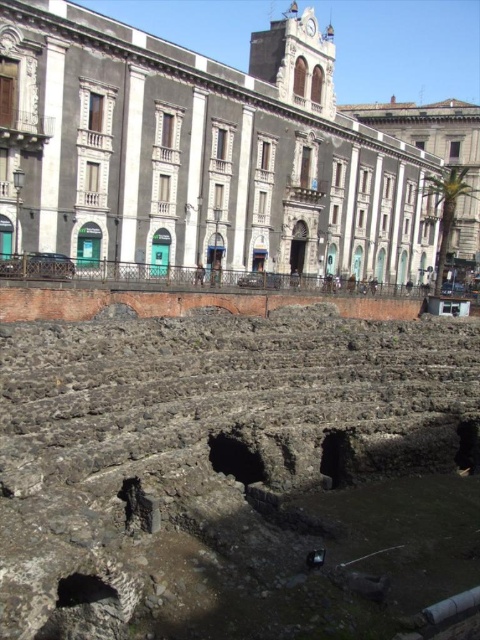
Can you confirm if dusty stone ruins at lower center is positioned to the right of dark gray stone building at center?

In fact, dusty stone ruins at lower center is to the left of dark gray stone building at center.

Between point (425, 342) and point (369, 205), which one is positioned behind?

The point (369, 205) is behind.

Between point (391, 627) and point (29, 58), which one is positioned in front?

Positioned in front is point (391, 627).

At what (x,y) coordinates should I click in order to perform the action: click on dusty stone ruins at lower center. Please return your answer as a coordinate pair (x, y). This screenshot has height=640, width=480. Looking at the image, I should click on (232, 476).

Is point (62, 593) positioned after point (458, 452)?

That is False.

Can you confirm if dark gray stone hole at lower left is positioned below dark stone hole at lower right?

Indeed, dark gray stone hole at lower left is positioned under dark stone hole at lower right.

The width and height of the screenshot is (480, 640). In order to click on dark gray stone hole at lower left in this screenshot , I will do `click(84, 589)`.

Does dark gray stone building at center appear over white marble palace at upper center?

No.

Can you confirm if dark gray stone building at center is smaller than white marble palace at upper center?

Yes.

Does point (196, 144) come in front of point (446, 122)?

Yes, point (196, 144) is closer to viewer.

Identify the location of dark gray stone building at center. The height and width of the screenshot is (640, 480). [199, 154].